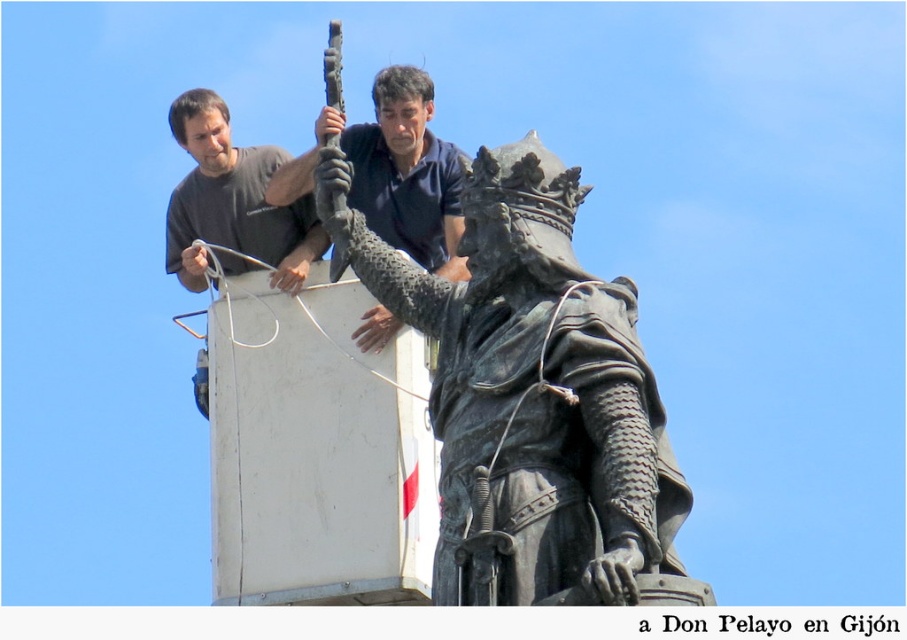
Between bronze statue at center and matte black shirt at upper center, which one is positioned higher?

matte black shirt at upper center

Is bronze statue at center shorter than matte black shirt at upper center?

Indeed, bronze statue at center has a lesser height compared to matte black shirt at upper center.

Which is in front, point (439, 545) or point (393, 209)?

Positioned in front is point (439, 545).

Find the location of `bronze statue at center`. bronze statue at center is located at coordinates (533, 397).

Can you confirm if matte gray shirt at upper left is thinner than matte black shirt at upper center?

Incorrect, matte gray shirt at upper left's width is not less than matte black shirt at upper center's.

Does matte gray shirt at upper left appear under matte black shirt at upper center?

Actually, matte gray shirt at upper left is above matte black shirt at upper center.

Does point (213, 138) lie in front of point (381, 77)?

No, (213, 138) is further to viewer.

You are a GUI agent. You are given a task and a screenshot of the screen. Output one action in this format:
    pyautogui.click(x=<x>, y=<y>)
    Task: Click on the matte gray shirt at upper left
    The width and height of the screenshot is (907, 640).
    Given the screenshot: What is the action you would take?
    pyautogui.click(x=231, y=200)

This screenshot has height=640, width=907. Identify the location of bronze statue at center. (533, 397).

Is point (642, 600) positioned in front of point (291, 253)?

Yes, it is.

Where is `bronze statue at center`? The height and width of the screenshot is (640, 907). bronze statue at center is located at coordinates (533, 397).

At what (x,y) coordinates should I click in order to perform the action: click on bronze statue at center. Please return your answer as a coordinate pair (x, y). Image resolution: width=907 pixels, height=640 pixels. Looking at the image, I should click on (533, 397).